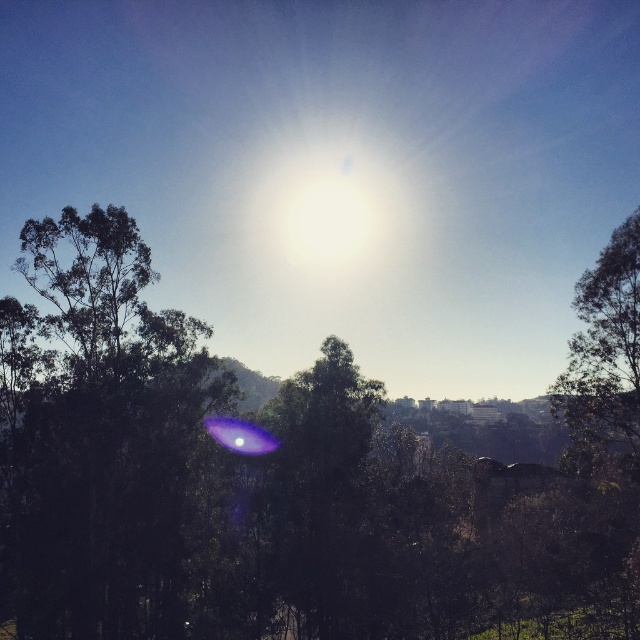
You are a bird looking for a place to perch. You see two trees in the scene, the green leafy tree at center and the green leafy tree at right. Which tree would you choose if you prefer a larger tree to rest on?

The green leafy tree at center is larger in size than the green leafy tree at right, so you should choose the green leafy tree at center to perch on.

You are an observer looking at the scene. You see the green leafy tree at upper left and the green leafy tree at right. Which tree is taller?

The green leafy tree at upper left is taller than the green leafy tree at right.